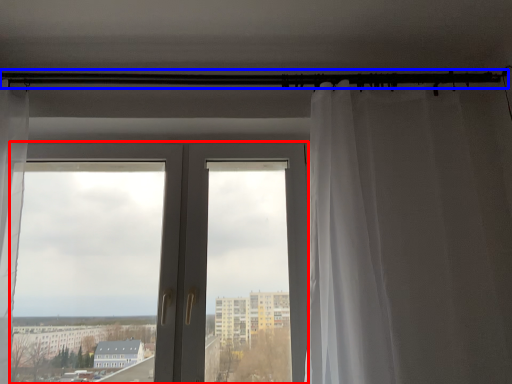
Question: Which of the following is the farthest to the observer, door (highlighted by a red box) or beam (highlighted by a blue box)?

Choices:
 (A) door
 (B) beam

Answer: (B)